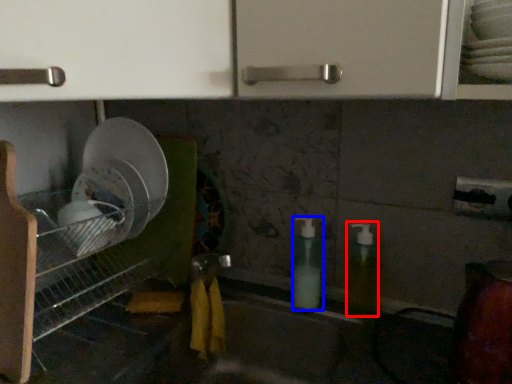
Question: Which object is further to the camera taking this photo, soap dispenser (highlighted by a red box) or soap dispenser (highlighted by a blue box)?

Choices:
 (A) soap dispenser
 (B) soap dispenser

Answer: (B)